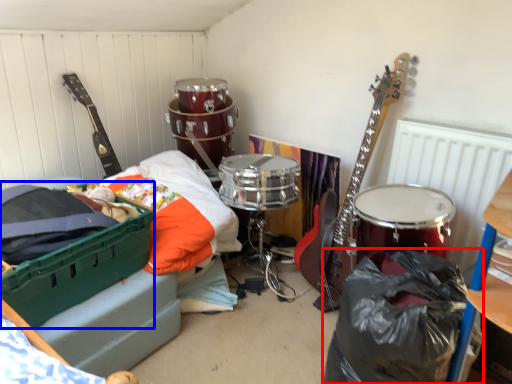
Question: Which of the following is the closest to the observer, garbage (highlighted by a red box) or storage box (highlighted by a blue box)?

Choices:
 (A) garbage
 (B) storage box

Answer: (A)